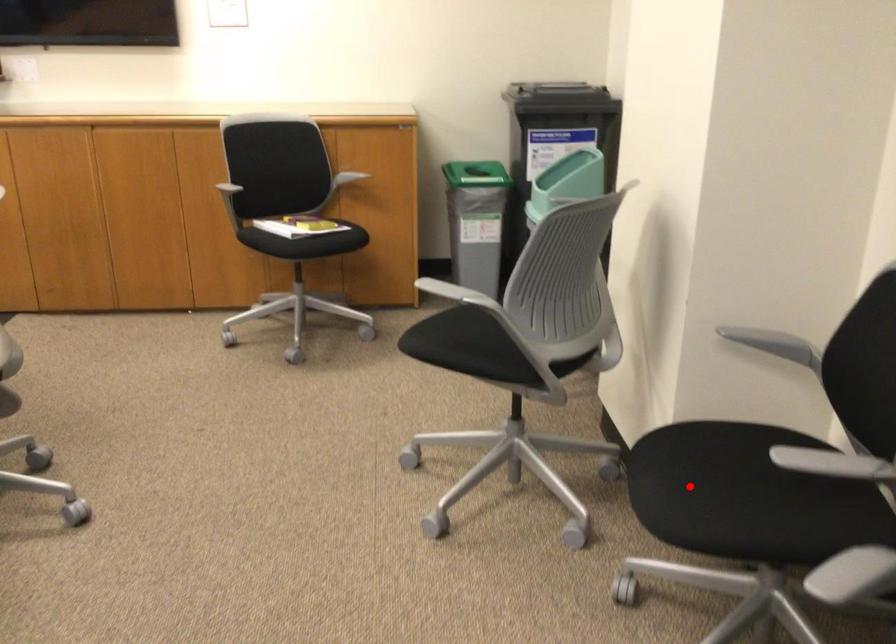
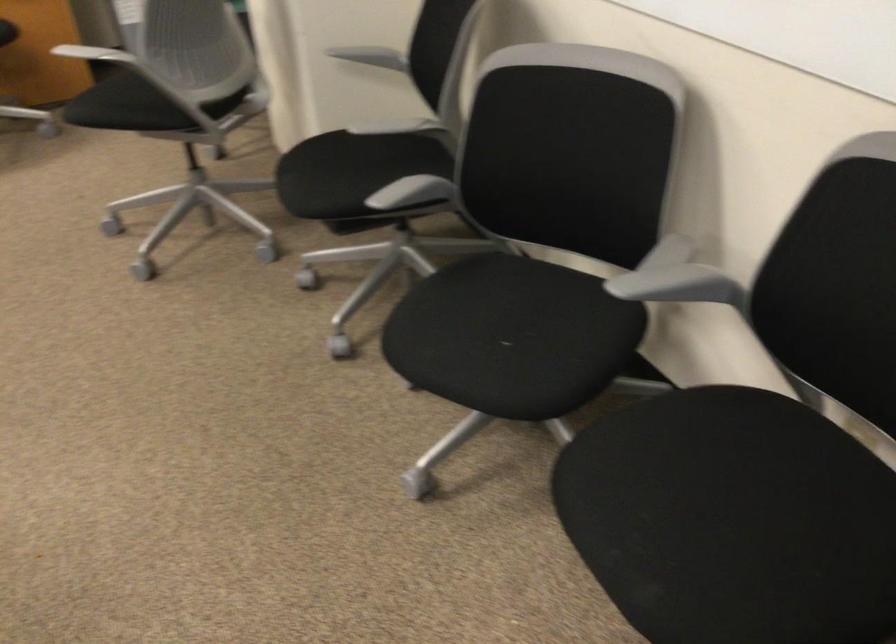
Question: I am providing you with two images of the same scene from different viewpoints. Image1 has a red point marked. In image2, the corresponding 3D location appears at what relative position? Reply with the corresponding letter.

Choices:
 (A) Closer
 (B) Farther

Answer: (B)